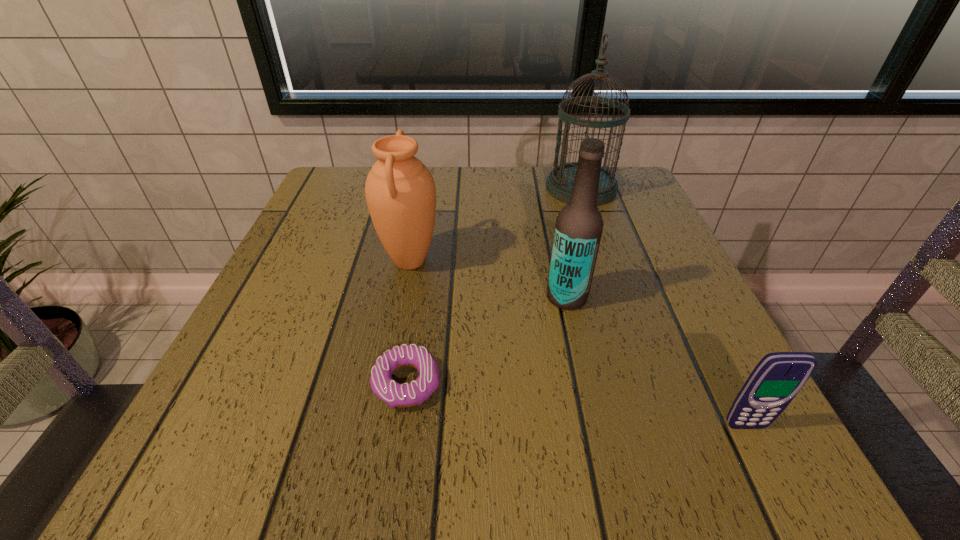
This screenshot has width=960, height=540. Find the location of `birdcage`. birdcage is located at coordinates (559, 183).

Where is `the tallest object`? the tallest object is located at coordinates (559, 183).

Identify the location of the fourth shortest object. This screenshot has width=960, height=540. (578, 229).

Identify the location of urn. Image resolution: width=960 pixels, height=540 pixels. (400, 191).

The height and width of the screenshot is (540, 960). I want to click on the nearest object, so click(778, 377).

Identify the location of the fourth tallest object. The width and height of the screenshot is (960, 540). (778, 377).

Image resolution: width=960 pixels, height=540 pixels. I want to click on the fourth farthest object, so click(404, 395).

Image resolution: width=960 pixels, height=540 pixels. What are the coordinates of `doughnut` in the screenshot? It's located at (404, 395).

Locate an element on the screen. This screenshot has height=540, width=960. free region located 0.140m on the front-facing side of the birdcage is located at coordinates (490, 188).

You are a GUI agent. You are given a task and a screenshot of the screen. Output one action in this format:
    pyautogui.click(x=<x>, y=<y>)
    Task: Click on the vacant area situated 0.300m on the front-facing side of the birdcage
    
    Given the screenshot: What is the action you would take?
    pyautogui.click(x=424, y=188)